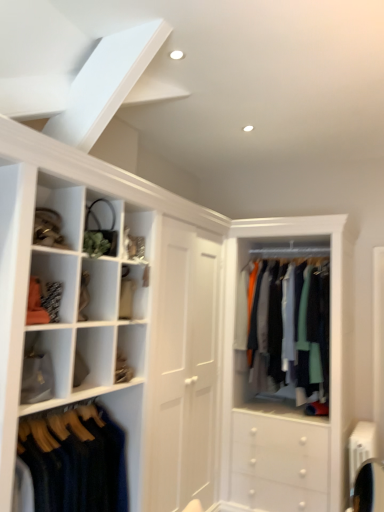
Question: From a real-world perspective, is matte black purse at upper left, arranged as the first cabinet when viewed from the top, physically above silky cotton shirts at center, which is counted as the first clothing, starting from the right?

Choices:
 (A) no
 (B) yes

Answer: (B)

Question: From the image's perspective, would you say matte black purse at upper left, arranged as the first cabinet when viewed from the top, is positioned over silky cotton shirts at center, the second clothing when ordered from left to right?

Choices:
 (A) yes
 (B) no

Answer: (A)

Question: Is matte black purse at upper left, arranged as the first cabinet when viewed from the top, next to silky cotton shirts at center, the second clothing when ordered from left to right?

Choices:
 (A) no
 (B) yes

Answer: (A)

Question: Is matte black purse at upper left, arranged as the first cabinet when viewed from the top, positioned beyond the bounds of silky cotton shirts at center, placed as the 2th clothing when sorted from front to back?

Choices:
 (A) yes
 (B) no

Answer: (A)

Question: Can you confirm if matte black purse at upper left, which is the third cabinet in bottom-to-top order, is bigger than silky cotton shirts at center, the 1th clothing from the back?

Choices:
 (A) yes
 (B) no

Answer: (B)

Question: Can you confirm if matte black purse at upper left, arranged as the first cabinet when viewed from the top, is positioned to the left of silky cotton shirts at center, which is counted as the first clothing, starting from the right?

Choices:
 (A) no
 (B) yes

Answer: (B)

Question: Is silky cotton shirts at center, the second clothing when ordered from left to right, not near dark blue wool sweater at lower left, acting as the 1th clothing starting from the front?

Choices:
 (A) no
 (B) yes

Answer: (B)

Question: Considering the relative sizes of silky cotton shirts at center, the second clothing when ordered from left to right, and dark blue wool sweater at lower left, which appears as the second clothing when viewed from the right, in the image provided, is silky cotton shirts at center, the second clothing when ordered from left to right, shorter than dark blue wool sweater at lower left, which appears as the second clothing when viewed from the right,?

Choices:
 (A) no
 (B) yes

Answer: (A)

Question: Is silky cotton shirts at center, the second clothing when ordered from left to right, bigger than dark blue wool sweater at lower left, acting as the 1th clothing starting from the front?

Choices:
 (A) yes
 (B) no

Answer: (A)

Question: From a real-world perspective, is silky cotton shirts at center, placed as the 2th clothing when sorted from front to back, below dark blue wool sweater at lower left, which appears as the second clothing when viewed from the right?

Choices:
 (A) yes
 (B) no

Answer: (B)

Question: From the image's perspective, would you say silky cotton shirts at center, the 1th clothing from the back, is shown under dark blue wool sweater at lower left, acting as the 1th clothing starting from the front?

Choices:
 (A) yes
 (B) no

Answer: (B)

Question: From a real-world perspective, is silky cotton shirts at center, the second clothing when ordered from left to right, on dark blue wool sweater at lower left, placed as the first clothing when sorted from left to right?

Choices:
 (A) yes
 (B) no

Answer: (A)

Question: Is silky cotton shirts at center, which is counted as the first clothing, starting from the right, closer to camera compared to matte gold purse at upper left, the second cabinet positioned from the top?

Choices:
 (A) yes
 (B) no

Answer: (B)